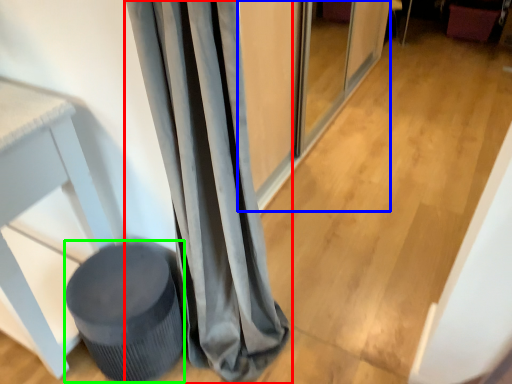
Question: Considering the real-world distances, which object is closest to curtain (highlighted by a red box)? screen door (highlighted by a blue box) or music stool (highlighted by a green box).

Choices:
 (A) screen door
 (B) music stool

Answer: (B)